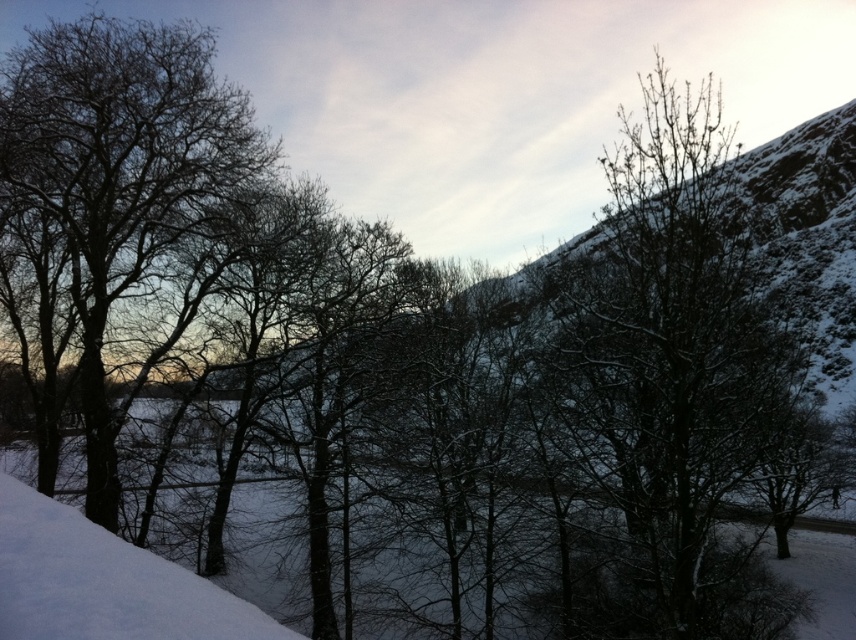
Does snow-covered tree at center have a lesser height compared to silvery snow-covered tree at left?

→ Incorrect, snow-covered tree at center's height does not fall short of silvery snow-covered tree at left's.

Does point (603, 406) come behind point (56, 99)?

No, it is in front of (56, 99).

Where is `snow-covered tree at center`? snow-covered tree at center is located at coordinates (672, 376).